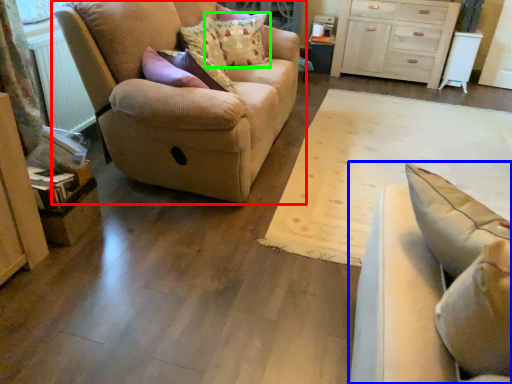
Question: Considering the real-world distances, which object is farthest from studio couch (highlighted by a red box)? studio couch (highlighted by a blue box) or pillow (highlighted by a green box)?

Choices:
 (A) studio couch
 (B) pillow

Answer: (A)